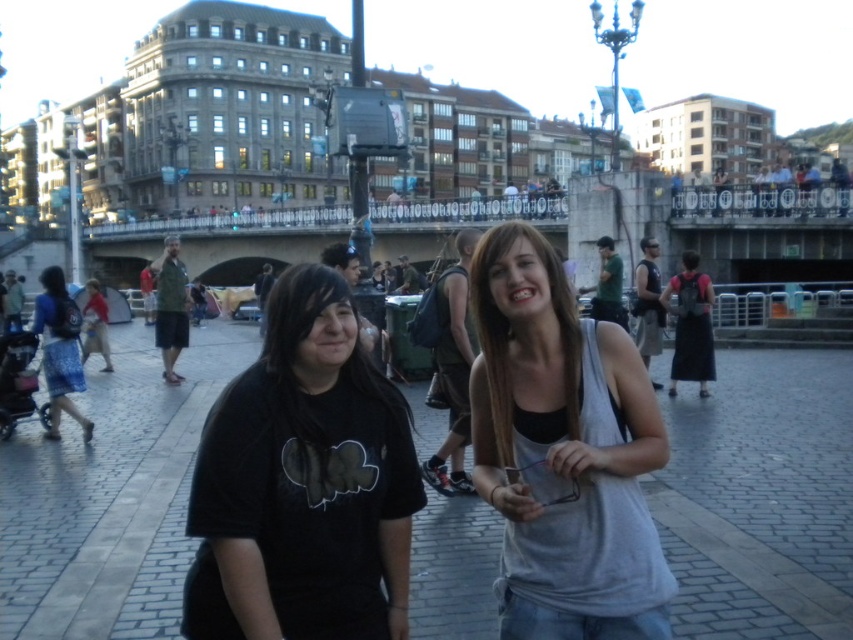
You are standing in the urban scene described. You see a point at coordinates (x=303, y=483). What object is this point located on?

The point at coordinates (x=303, y=483) is located on the black matte shirt at center.

You are a photographer trying to capture the two people in the scene. The gray cotton tank top at center and the blue denim skirt at left are both in focus. Which clothing item is positioned lower in the image?

The gray cotton tank top at center is positioned below the blue denim skirt at left, so it is lower in the image.